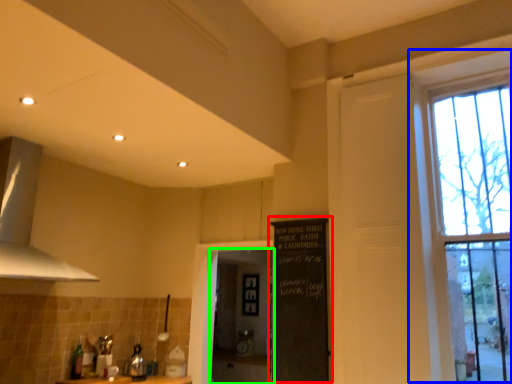
Question: Considering the real-world distances, which object is farthest from bulletin board (highlighted by a red box)? window (highlighted by a blue box) or screen door (highlighted by a green box)?

Choices:
 (A) window
 (B) screen door

Answer: (B)